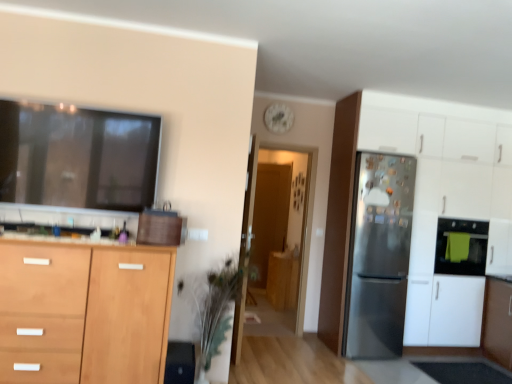
Question: Is green towel oven at right thinner than satin silver refrigerator at right?

Choices:
 (A) yes
 (B) no

Answer: (A)

Question: Considering the relative sizes of green towel oven at right and satin silver refrigerator at right in the image provided, is green towel oven at right smaller than satin silver refrigerator at right?

Choices:
 (A) yes
 (B) no

Answer: (A)

Question: Is green towel oven at right to the right of satin silver refrigerator at right from the viewer's perspective?

Choices:
 (A) no
 (B) yes

Answer: (B)

Question: Considering the relative positions of green towel oven at right and satin silver refrigerator at right in the image provided, is green towel oven at right to the left of satin silver refrigerator at right from the viewer's perspective?

Choices:
 (A) no
 (B) yes

Answer: (A)

Question: From a real-world perspective, is green towel oven at right physically above satin silver refrigerator at right?

Choices:
 (A) yes
 (B) no

Answer: (A)

Question: In terms of width, does transparent glass door at center, which ranks as the second glass door in back-to-front order, look wider or thinner when compared to satin silver refrigerator at right?

Choices:
 (A) wide
 (B) thin

Answer: (B)

Question: From the image's perspective, is transparent glass door at center, which ranks as the second glass door in back-to-front order, located above or below satin silver refrigerator at right?

Choices:
 (A) above
 (B) below

Answer: (A)

Question: Considering the positions of point (285, 291) and point (393, 292), is point (285, 291) closer or farther from the camera than point (393, 292)?

Choices:
 (A) farther
 (B) closer

Answer: (A)

Question: In the image, is transparent glass door at center, which ranks as the second glass door in back-to-front order, positioned in front of or behind satin silver refrigerator at right?

Choices:
 (A) behind
 (B) front

Answer: (A)

Question: Is satin silver refrigerator at right, the 2th cabinetry when ordered from front to back, situated inside satin silver refrigerator at right or outside?

Choices:
 (A) outside
 (B) inside

Answer: (A)

Question: From the image's perspective, is satin silver refrigerator at right, the 2th cabinetry when ordered from front to back, positioned above or below satin silver refrigerator at right?

Choices:
 (A) above
 (B) below

Answer: (A)

Question: Relative to satin silver refrigerator at right, is satin silver refrigerator at right, the first cabinetry positioned from the right, in front or behind?

Choices:
 (A) behind
 (B) front

Answer: (A)

Question: Looking at the image, does satin silver refrigerator at right, the first cabinetry positioned from the right, seem bigger or smaller compared to satin silver refrigerator at right?

Choices:
 (A) big
 (B) small

Answer: (A)

Question: From their relative heights in the image, would you say green towel oven at right is taller or shorter than satin silver refrigerator at right, the 2th cabinetry when ordered from front to back?

Choices:
 (A) short
 (B) tall

Answer: (A)

Question: Looking at the image, does green towel oven at right seem bigger or smaller compared to satin silver refrigerator at right, which is the 3th cabinetry in left-to-right order?

Choices:
 (A) small
 (B) big

Answer: (A)